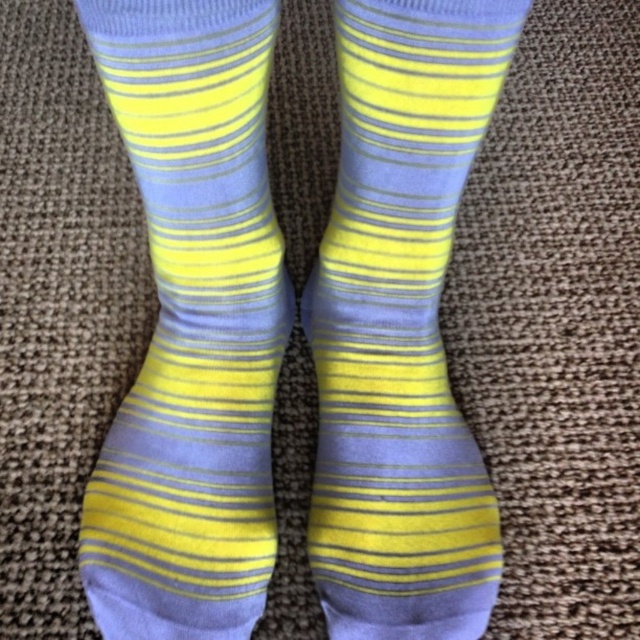
You are standing in a room and see a point marked at coordinates (192, 326). What object is located at that point?

The point at (192, 326) corresponds to the matte yellow blue striped sock at center.